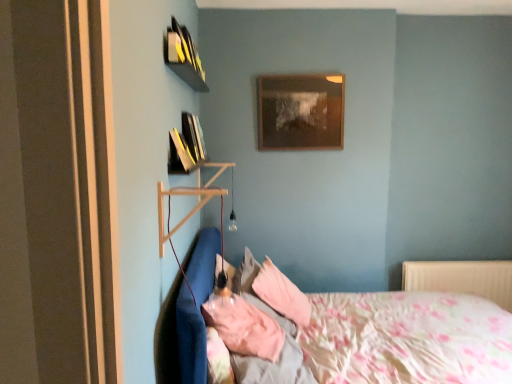
At what (x,y) coordinates should I click in order to perform the action: click on free point above white plastic radiator at lower right (from a real-world perspective). Please return your answer as a coordinate pair (x, y). This screenshot has width=512, height=384. Looking at the image, I should click on (467, 261).